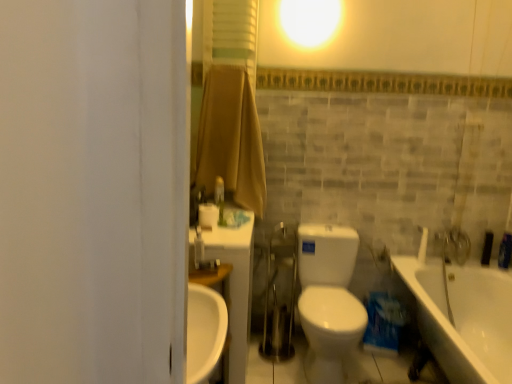
Question: From the image's perspective, would you say white matte toilet paper at center is positioned over white plastic faucet at upper left?

Choices:
 (A) no
 (B) yes

Answer: (B)

Question: Does white matte toilet paper at center appear on the right side of white plastic faucet at upper left?

Choices:
 (A) yes
 (B) no

Answer: (A)

Question: Is the position of white matte toilet paper at center more distant than that of white plastic faucet at upper left?

Choices:
 (A) no
 (B) yes

Answer: (B)

Question: Considering the relative sizes of white matte toilet paper at center and white plastic faucet at upper left in the image provided, is white matte toilet paper at center wider than white plastic faucet at upper left?

Choices:
 (A) yes
 (B) no

Answer: (A)

Question: Would you consider white matte toilet paper at center to be distant from white plastic faucet at upper left?

Choices:
 (A) yes
 (B) no

Answer: (B)

Question: Is white matte toilet paper at center aimed at white plastic faucet at upper left?

Choices:
 (A) no
 (B) yes

Answer: (A)

Question: From the image's perspective, is white plastic faucet at upper left over white glossy toilet at center?

Choices:
 (A) no
 (B) yes

Answer: (B)

Question: From a real-world perspective, is white plastic faucet at upper left on white glossy toilet at center?

Choices:
 (A) no
 (B) yes

Answer: (B)

Question: Could you tell me if white plastic faucet at upper left is turned towards white glossy toilet at center?

Choices:
 (A) no
 (B) yes

Answer: (A)

Question: Is white plastic faucet at upper left looking in the opposite direction of white glossy toilet at center?

Choices:
 (A) yes
 (B) no

Answer: (B)

Question: Does white plastic faucet at upper left have a greater height compared to white glossy toilet at center?

Choices:
 (A) yes
 (B) no

Answer: (B)

Question: Is white plastic faucet at upper left not within white glossy toilet at center?

Choices:
 (A) no
 (B) yes

Answer: (B)

Question: Considering the relative positions of white glossy faucet at upper right and white plastic faucet at upper left in the image provided, is white glossy faucet at upper right to the left of white plastic faucet at upper left from the viewer's perspective?

Choices:
 (A) no
 (B) yes

Answer: (A)